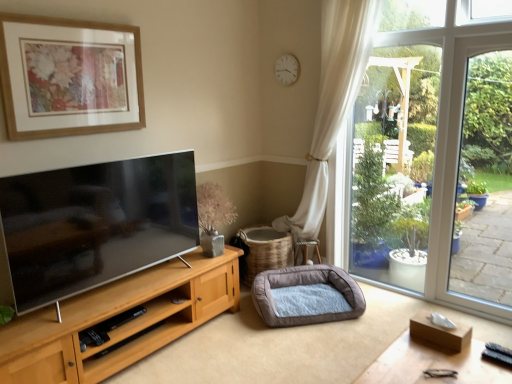
Question: Should I look upward or downward to see wooden table at lower right?

Choices:
 (A) up
 (B) down

Answer: (B)

Question: Is wooden picture frame at upper left located within beige woven basket at center?

Choices:
 (A) no
 (B) yes

Answer: (A)

Question: Is beige woven basket at center to the right of wooden picture frame at upper left from the viewer's perspective?

Choices:
 (A) no
 (B) yes

Answer: (B)

Question: Is beige woven basket at center oriented towards wooden picture frame at upper left?

Choices:
 (A) yes
 (B) no

Answer: (B)

Question: From a real-world perspective, is beige woven basket at center below wooden picture frame at upper left?

Choices:
 (A) yes
 (B) no

Answer: (A)

Question: Does beige woven basket at center have a greater height compared to wooden picture frame at upper left?

Choices:
 (A) no
 (B) yes

Answer: (A)

Question: Is beige woven basket at center thinner than wooden picture frame at upper left?

Choices:
 (A) yes
 (B) no

Answer: (B)

Question: Is soft gray fabric dog bed at lower center wider than wooden picture frame at upper left?

Choices:
 (A) no
 (B) yes

Answer: (B)

Question: Considering the relative sizes of soft gray fabric dog bed at lower center and wooden picture frame at upper left in the image provided, is soft gray fabric dog bed at lower center taller than wooden picture frame at upper left?

Choices:
 (A) yes
 (B) no

Answer: (B)

Question: Is soft gray fabric dog bed at lower center oriented away from wooden picture frame at upper left?

Choices:
 (A) no
 (B) yes

Answer: (A)

Question: Is soft gray fabric dog bed at lower center further to the viewer compared to wooden picture frame at upper left?

Choices:
 (A) no
 (B) yes

Answer: (B)

Question: Would you say soft gray fabric dog bed at lower center is a long distance from wooden picture frame at upper left?

Choices:
 (A) no
 (B) yes

Answer: (B)

Question: Is soft gray fabric dog bed at lower center to the right of wooden picture frame at upper left from the viewer's perspective?

Choices:
 (A) no
 (B) yes

Answer: (B)

Question: Does beige woven basket at center turn towards soft gray fabric dog bed at lower center?

Choices:
 (A) no
 (B) yes

Answer: (B)